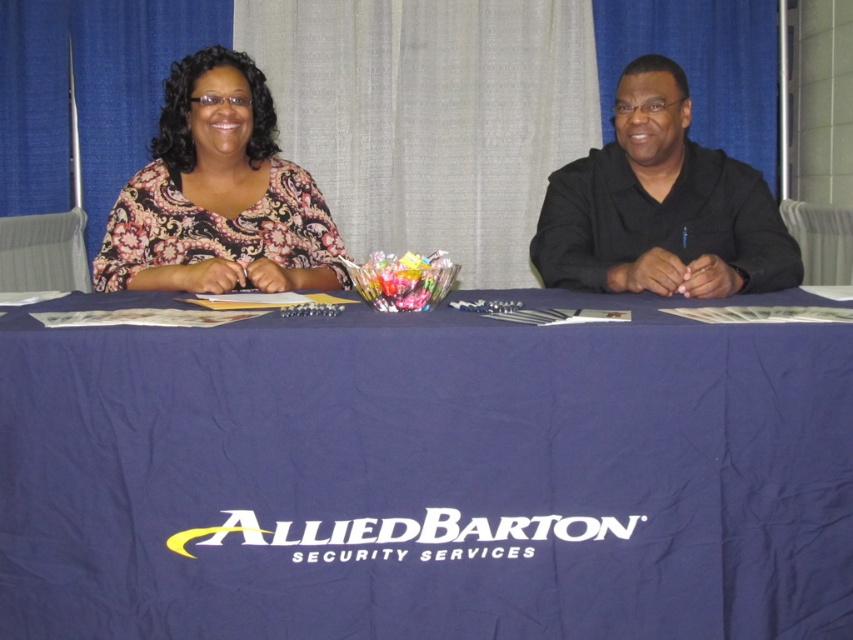
Which of these two, navy blue fabric at center or paisley-patterned blouse at upper left, stands shorter?

With less height is navy blue fabric at center.

Between point (540, 420) and point (148, 272), which one is positioned in front?

Point (540, 420) is more forward.

Find the location of a particular element. Image resolution: width=853 pixels, height=640 pixels. navy blue fabric at center is located at coordinates (426, 476).

Who is more distant from viewer, (447, 625) or (735, 184)?

Positioned behind is point (735, 184).

Does navy blue fabric at center have a larger size compared to black matte shirt at right?

Correct, navy blue fabric at center is larger in size than black matte shirt at right.

Is point (471, 554) in front of point (740, 237)?

That is True.

This screenshot has height=640, width=853. I want to click on navy blue fabric at center, so click(426, 476).

Is paisley-patterned blouse at upper left bigger than black matte shirt at right?

Yes.

Is paisley-patterned blouse at upper left smaller than black matte shirt at right?

No.

Where is `paisley-patterned blouse at upper left`? This screenshot has height=640, width=853. paisley-patterned blouse at upper left is located at coordinates (218, 195).